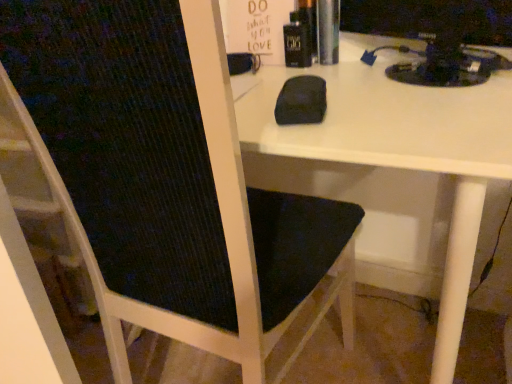
What do you see at coordinates (438, 36) in the screenshot? This screenshot has height=384, width=512. I see `black plastic monitor at upper right` at bounding box center [438, 36].

You are a GUI agent. You are given a task and a screenshot of the screen. Output one action in this format:
    pyautogui.click(x=<x>, y=<y>)
    Task: Click on the black plastic monitor at upper right
    
    Given the screenshot: What is the action you would take?
    pyautogui.click(x=438, y=36)

Based on the photo, measure the distance between black fabric chair at center and camera.

The distance of black fabric chair at center from camera is 16.36 inches.

Find the location of `black fabric chair at center`. black fabric chair at center is located at coordinates (167, 179).

This screenshot has height=384, width=512. What do you see at coordinates (167, 179) in the screenshot? I see `black fabric chair at center` at bounding box center [167, 179].

The width and height of the screenshot is (512, 384). Identify the location of black plastic monitor at upper right. (438, 36).

Considering the relative positions of black fabric chair at center and black plastic monitor at upper right in the image provided, is black fabric chair at center to the left of black plastic monitor at upper right from the viewer's perspective?

Yes.

From the picture: Which object is closer to the camera, black fabric chair at center or black plastic monitor at upper right?

black fabric chair at center is more forward.

Is point (211, 262) closer to viewer compared to point (384, 2)?

Yes, it is.

From the image's perspective, which is above, black fabric chair at center or black plastic monitor at upper right?

black plastic monitor at upper right, from the image's perspective.

From a real-world perspective, is black fabric chair at center positioned above or below black plastic monitor at upper right?

In terms of real-world spatial position, black fabric chair at center is below black plastic monitor at upper right.

Which of these two, black fabric chair at center or black plastic monitor at upper right, is wider?

black fabric chair at center.

Between black fabric chair at center and black plastic monitor at upper right, which one has less height?

Standing shorter between the two is black plastic monitor at upper right.

Between black fabric chair at center and black plastic monitor at upper right, which one has smaller size?

With smaller size is black plastic monitor at upper right.

Is black plastic monitor at upper right completely or partially inside black fabric chair at center?

No, black plastic monitor at upper right is not surrounded by black fabric chair at center.

Is black fabric chair at center next to black plastic monitor at upper right and touching it?

They are not placed beside each other.

Is black fabric chair at center aimed at black plastic monitor at upper right?

No, black fabric chair at center does not turn towards black plastic monitor at upper right.

How distant is black fabric chair at center from black plastic monitor at upper right?

A distance of 20.50 inches exists between black fabric chair at center and black plastic monitor at upper right.

Image resolution: width=512 pixels, height=384 pixels. Find the location of `chair beneath the black plastic monitor at upper right (from a real-world perspective)`. chair beneath the black plastic monitor at upper right (from a real-world perspective) is located at coordinates (167, 179).

Is black plastic monitor at upper right at the left side of black fabric chair at center?

No, black plastic monitor at upper right is not to the left of black fabric chair at center.

Based on the photo, which object is further away from the camera, black plastic monitor at upper right or black fabric chair at center?

black plastic monitor at upper right is behind.

Which is closer, (483, 18) or (234, 120)?

The point (234, 120) is in front.

Based on the photo, from the image's perspective, is black plastic monitor at upper right located beneath black fabric chair at center?

No, from the image's perspective, black plastic monitor at upper right is not beneath black fabric chair at center.

From a real-world perspective, is black plastic monitor at upper right under black fabric chair at center?

Actually, black plastic monitor at upper right is physically above black fabric chair at center in the real world.

Can you confirm if black plastic monitor at upper right is wider than black fabric chair at center?

In fact, black plastic monitor at upper right might be narrower than black fabric chair at center.

Considering the relative sizes of black plastic monitor at upper right and black fabric chair at center in the image provided, is black plastic monitor at upper right shorter than black fabric chair at center?

Yes, black plastic monitor at upper right is shorter than black fabric chair at center.

In the scene shown: Considering the sizes of objects black plastic monitor at upper right and black fabric chair at center in the image provided, who is bigger, black plastic monitor at upper right or black fabric chair at center?

Bigger between the two is black fabric chair at center.

Can we say black plastic monitor at upper right lies outside black fabric chair at center?

Yes, black plastic monitor at upper right is outside of black fabric chair at center.

Is black plastic monitor at upper right directly adjacent to black fabric chair at center?

They are not placed beside each other.

Is black fabric chair at center at the back of black plastic monitor at upper right?

No, black plastic monitor at upper right is not facing the opposite direction of black fabric chair at center.

How many degrees apart are the facing directions of black plastic monitor at upper right and black fabric chair at center?

They differ by 29.2 degrees in their facing directions.

In the image, there is a black plastic monitor at upper right. Where is `chair below it (from a real-world perspective)`? chair below it (from a real-world perspective) is located at coordinates (167, 179).

Where is `desktop computer behind the black fabric chair at center`? desktop computer behind the black fabric chair at center is located at coordinates (438, 36).

Image resolution: width=512 pixels, height=384 pixels. I want to click on chair below the black plastic monitor at upper right (from a real-world perspective), so click(167, 179).